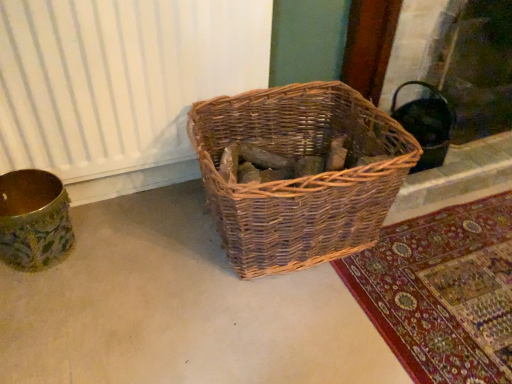
Question: Is gold textured vase at left in front of or behind black matte fireplace at upper right in the image?

Choices:
 (A) front
 (B) behind

Answer: (A)

Question: From a real-world perspective, is gold textured vase at left above or below black matte fireplace at upper right?

Choices:
 (A) below
 (B) above

Answer: (A)

Question: Which is nearer to the white textured radiator at left?

Choices:
 (A) natural woven basket at center
 (B) black matte fireplace at upper right
 (C) gold textured vase at left

Answer: (C)

Question: Estimate the real-world distances between objects in this image. Which object is farther from the black matte fireplace at upper right?

Choices:
 (A) white textured radiator at left
 (B) gold textured vase at left
 (C) natural woven basket at center

Answer: (B)